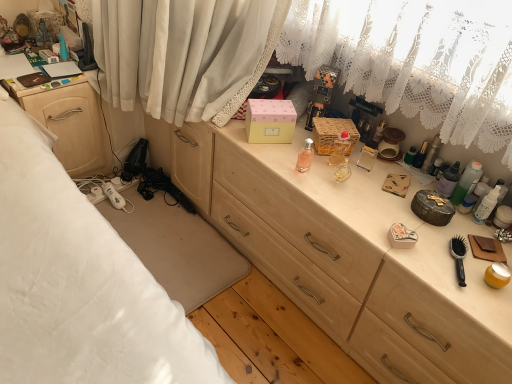
Question: Is the position of translucent plastic bottles at right, the second toiletry when ordered from right to left, more distant than that of pink matte box at center?

Choices:
 (A) yes
 (B) no

Answer: (B)

Question: Can you confirm if translucent plastic bottles at right, the second toiletry when ordered from right to left, is bigger than pink matte box at center?

Choices:
 (A) yes
 (B) no

Answer: (B)

Question: Considering the relative sizes of translucent plastic bottles at right, the second toiletry when ordered from right to left, and pink matte box at center in the image provided, is translucent plastic bottles at right, the second toiletry when ordered from right to left, thinner than pink matte box at center?

Choices:
 (A) no
 (B) yes

Answer: (B)

Question: From the image's perspective, is translucent plastic bottles at right, the second toiletry when ordered from right to left, on top of pink matte box at center?

Choices:
 (A) no
 (B) yes

Answer: (A)

Question: Considering the relative sizes of translucent plastic bottles at right, the second toiletry when ordered from right to left, and pink matte box at center in the image provided, is translucent plastic bottles at right, the second toiletry when ordered from right to left, wider than pink matte box at center?

Choices:
 (A) no
 (B) yes

Answer: (A)

Question: Is translucent glass perfume at center, acting as the second toiletry starting from the left, bigger or smaller than pink glass perfume at center, the first toiletry in the left-to-right sequence?

Choices:
 (A) big
 (B) small

Answer: (A)

Question: Is translucent glass perfume at center, acting as the second toiletry starting from the left, wider or thinner than pink glass perfume at center, marked as the 5th toiletry in a right-to-left arrangement?

Choices:
 (A) wide
 (B) thin

Answer: (B)

Question: Considering the relative positions of translucent glass perfume at center, acting as the 4th toiletry starting from the right, and pink glass perfume at center, the first toiletry in the left-to-right sequence, in the image provided, is translucent glass perfume at center, acting as the 4th toiletry starting from the right, to the left or to the right of pink glass perfume at center, the first toiletry in the left-to-right sequence,?

Choices:
 (A) right
 (B) left

Answer: (A)

Question: From a real-world perspective, is translucent glass perfume at center, acting as the second toiletry starting from the left, above or below pink glass perfume at center, marked as the 5th toiletry in a right-to-left arrangement?

Choices:
 (A) above
 (B) below

Answer: (A)

Question: Considering their positions, is matte wood nightstand at left located in front of or behind white glossy lotion at right, which is the fifth toiletry in left-to-right order?

Choices:
 (A) front
 (B) behind

Answer: (B)

Question: From a real-world perspective, is matte wood nightstand at left physically located above or below white glossy lotion at right, which is the fifth toiletry in left-to-right order?

Choices:
 (A) below
 (B) above

Answer: (A)

Question: Is point (110, 157) closer or farther from the camera than point (479, 203)?

Choices:
 (A) farther
 (B) closer

Answer: (A)

Question: From the image's perspective, is matte wood nightstand at left positioned above or below white glossy lotion at right, which is the fifth toiletry in left-to-right order?

Choices:
 (A) above
 (B) below

Answer: (A)

Question: Visually, is white glossy lotion at right, which is the fifth toiletry in left-to-right order, positioned to the left or to the right of pink glass perfume at center, marked as the 5th toiletry in a right-to-left arrangement?

Choices:
 (A) right
 (B) left

Answer: (A)

Question: From a real-world perspective, is white glossy lotion at right, which is the fifth toiletry in left-to-right order, physically located above or below pink glass perfume at center, marked as the 5th toiletry in a right-to-left arrangement?

Choices:
 (A) above
 (B) below

Answer: (B)